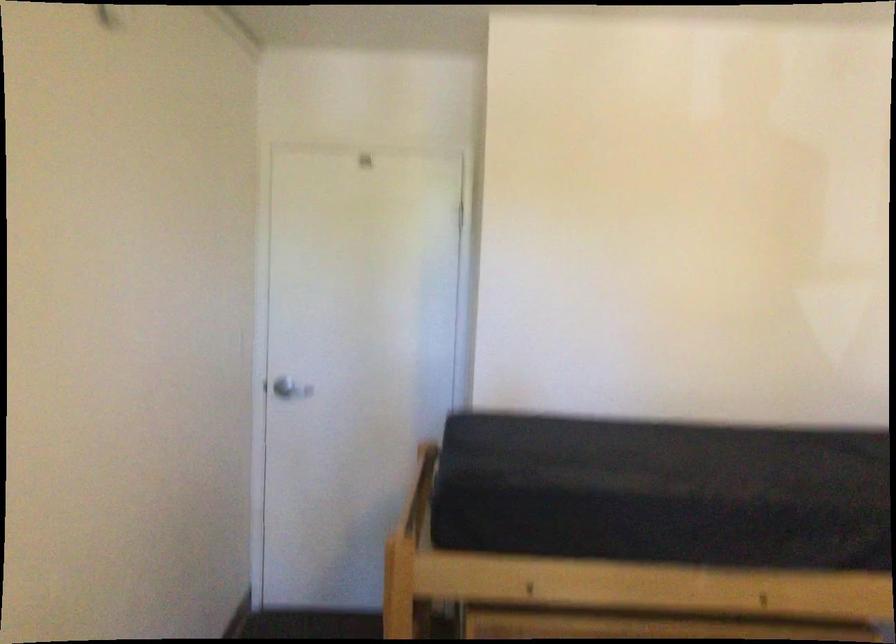
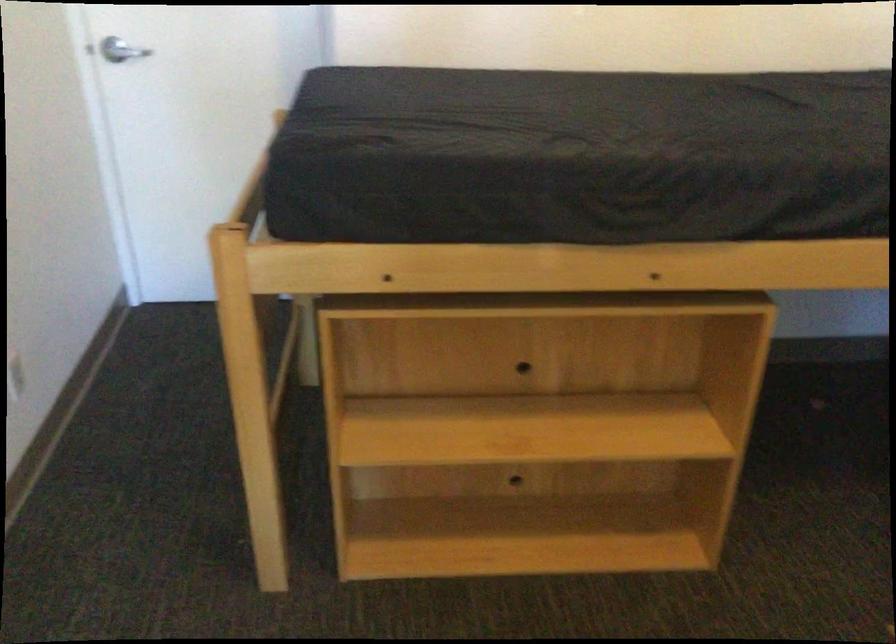
Question: The first image is from the beginning of the video and the second image is from the end. How did the camera likely rotate when shooting the video?

Choices:
 (A) Left
 (B) Right
 (C) Up
 (D) Down

Answer: (D)